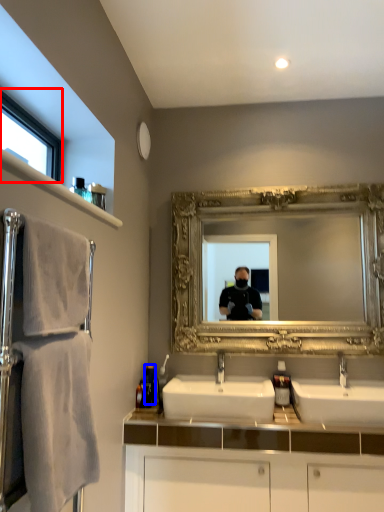
Question: Which point is further to the camera, window (highlighted by a red box) or toiletry (highlighted by a blue box)?

Choices:
 (A) window
 (B) toiletry

Answer: (B)